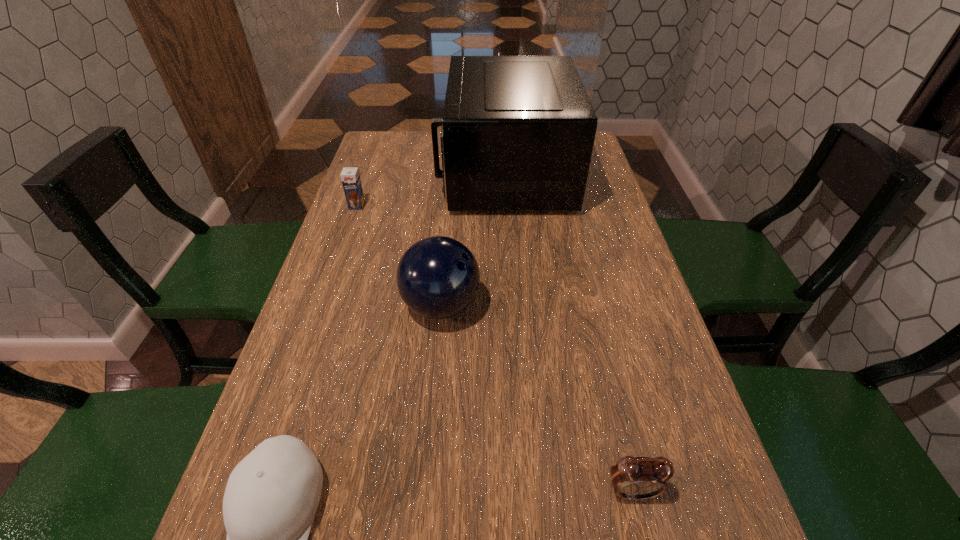
The width and height of the screenshot is (960, 540). What are the coordinates of `object that is at the far edge` in the screenshot? It's located at (517, 134).

Where is `object at the left edge`? object at the left edge is located at coordinates (350, 177).

At what (x,y) coordinates should I click in order to perform the action: click on microwave_oven at the right edge. Please return your answer as a coordinate pair (x, y). The image size is (960, 540). Looking at the image, I should click on (517, 134).

Find the location of a particular element. The height and width of the screenshot is (540, 960). alarm clock that is at the right edge is located at coordinates (634, 478).

Identify the location of object positioned at the far right corner. The width and height of the screenshot is (960, 540). (517, 134).

At what (x,y) coordinates should I click in order to perform the action: click on free location at the left edge of the desktop. Please return your answer as a coordinate pair (x, y). Looking at the image, I should click on (369, 309).

The width and height of the screenshot is (960, 540). Identify the location of blank space at the right edge. (645, 322).

Where is `free spot at the far left corner of the desktop`? The height and width of the screenshot is (540, 960). free spot at the far left corner of the desktop is located at coordinates (384, 146).

You are a GUI agent. You are given a task and a screenshot of the screen. Output one action in this format:
    pyautogui.click(x=<x>, y=<y>)
    Task: Click on the unoccupied area between the alarm clock and the chocolate milk
    This screenshot has height=540, width=960.
    Given the screenshot: What is the action you would take?
    pyautogui.click(x=494, y=348)

Where is `free spot between the tallest object and the chocolate milk`? The height and width of the screenshot is (540, 960). free spot between the tallest object and the chocolate milk is located at coordinates (430, 190).